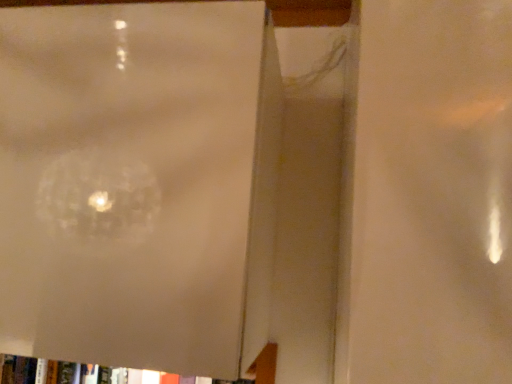
In order to click on white glossy board at center in this screenshot , I will do [129, 181].

What do you see at coordinates (129, 181) in the screenshot? The width and height of the screenshot is (512, 384). I see `white glossy board at center` at bounding box center [129, 181].

The height and width of the screenshot is (384, 512). Identify the location of white glossy board at center. pos(129,181).